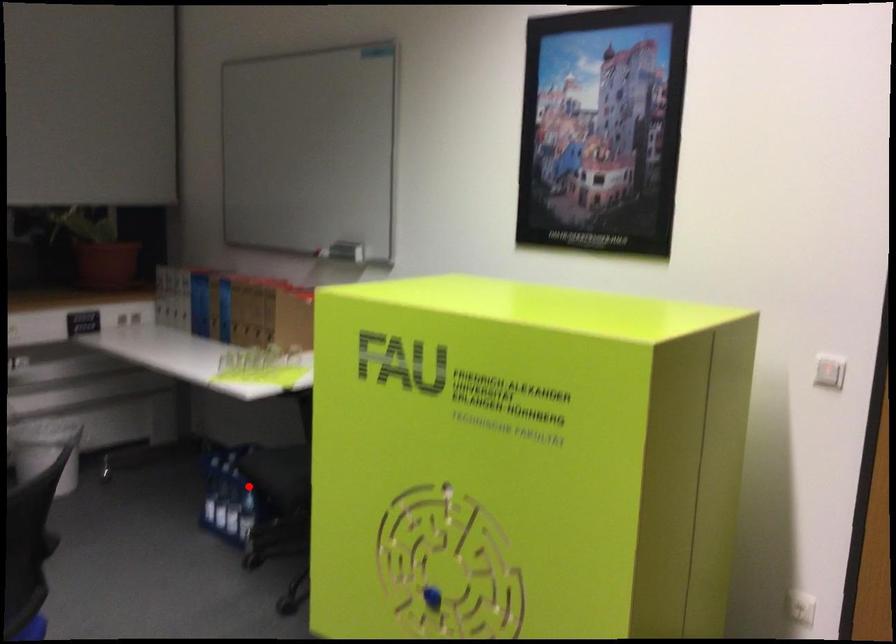
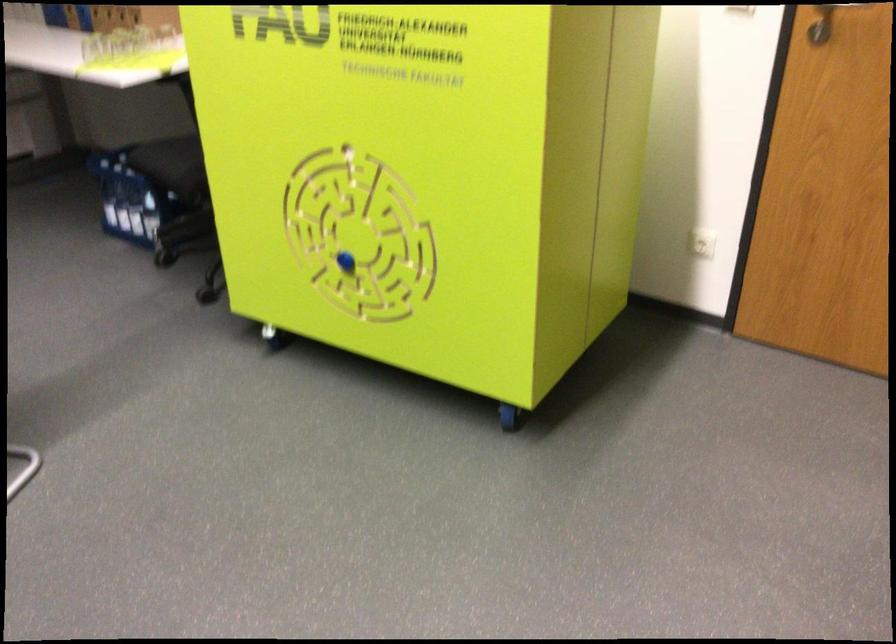
Where in the second image is the point corresponding to the highlighted location from the first image?

(149, 185)